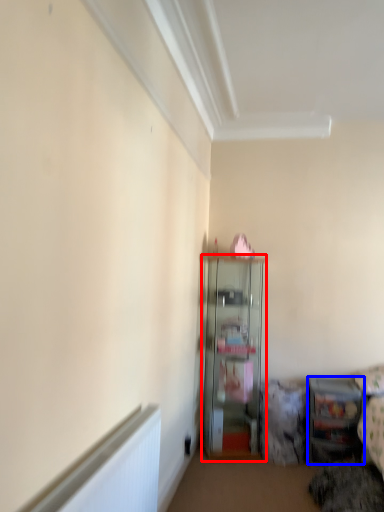
Question: Which of the following is the closest to the observer, shelf (highlighted by a red box) or shelf (highlighted by a blue box)?

Choices:
 (A) shelf
 (B) shelf

Answer: (B)